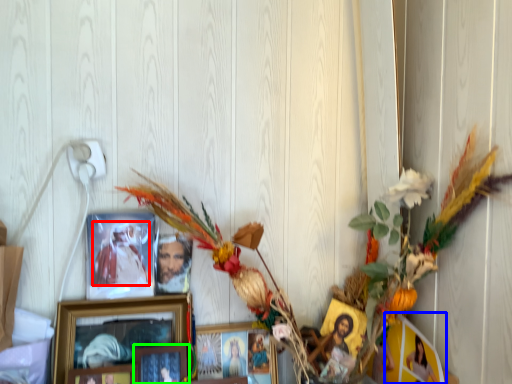
Question: Which object is the closest to the person (highlighted by a red box)? Choose among these: picture frame (highlighted by a blue box) or picture frame (highlighted by a green box).

Choices:
 (A) picture frame
 (B) picture frame

Answer: (B)